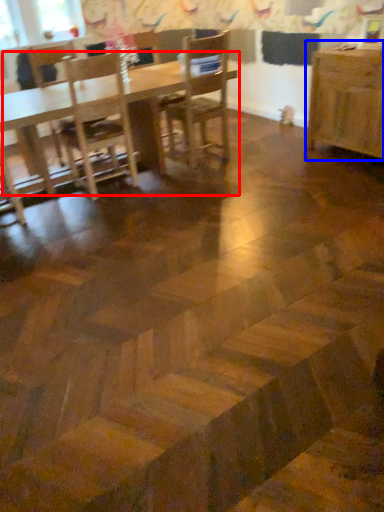
Question: Which object appears farthest to the camera in this image, table (highlighted by a red box) or table (highlighted by a blue box)?

Choices:
 (A) table
 (B) table

Answer: (B)